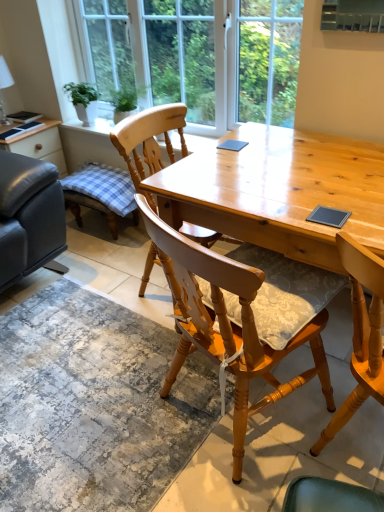
Question: Can you confirm if clear glass window at upper center is positioned to the right of light brown wooden desk at center?

Choices:
 (A) yes
 (B) no

Answer: (B)

Question: Is clear glass window at upper center in contact with light brown wooden desk at center?

Choices:
 (A) yes
 (B) no

Answer: (B)

Question: Is clear glass window at upper center to the left of light brown wooden desk at center from the viewer's perspective?

Choices:
 (A) no
 (B) yes

Answer: (B)

Question: Would you say clear glass window at upper center is a long distance from light brown wooden desk at center?

Choices:
 (A) no
 (B) yes

Answer: (A)

Question: Is clear glass window at upper center smaller than light brown wooden desk at center?

Choices:
 (A) no
 (B) yes

Answer: (B)

Question: Is textured gray rug at lower center wider or thinner than wooden chair with cushion at center, the second chair from the back?

Choices:
 (A) thin
 (B) wide

Answer: (B)

Question: Is textured gray rug at lower center taller or shorter than wooden chair with cushion at center, the second chair from the back?

Choices:
 (A) short
 (B) tall

Answer: (A)

Question: In the image, is textured gray rug at lower center positioned in front of or behind wooden chair with cushion at center, which appears as the 1th chair when viewed from the front?

Choices:
 (A) behind
 (B) front

Answer: (A)

Question: From the image's perspective, is textured gray rug at lower center located above or below wooden chair with cushion at center, which appears as the 1th chair when viewed from the front?

Choices:
 (A) above
 (B) below

Answer: (B)

Question: Is green leafy plant in white pot at upper left in front of or behind light brown wooden desk at center in the image?

Choices:
 (A) behind
 (B) front

Answer: (A)

Question: From the image's perspective, is green leafy plant in white pot at upper left above or below light brown wooden desk at center?

Choices:
 (A) above
 (B) below

Answer: (A)

Question: Looking at their shapes, would you say green leafy plant in white pot at upper left is wider or thinner than light brown wooden desk at center?

Choices:
 (A) wide
 (B) thin

Answer: (B)

Question: Does point (69, 82) appear closer or farther from the camera than point (319, 183)?

Choices:
 (A) closer
 (B) farther

Answer: (B)

Question: In terms of width, does wooden chair with cushion at center, the second chair from the back, look wider or thinner when compared to light brown wooden desk at center?

Choices:
 (A) wide
 (B) thin

Answer: (B)

Question: Relative to light brown wooden desk at center, is wooden chair with cushion at center, the second chair from the back, in front or behind?

Choices:
 (A) front
 (B) behind

Answer: (A)